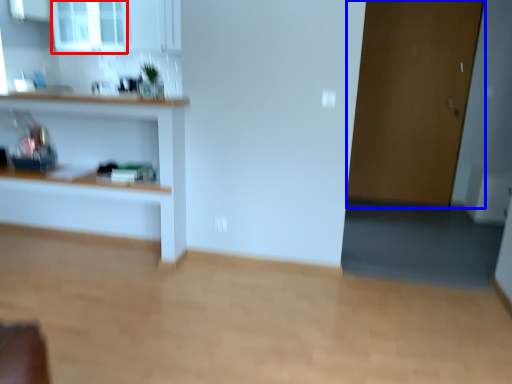
Question: Which of the following is the farthest to the observer, window (highlighted by a red box) or door (highlighted by a blue box)?

Choices:
 (A) window
 (B) door

Answer: (A)